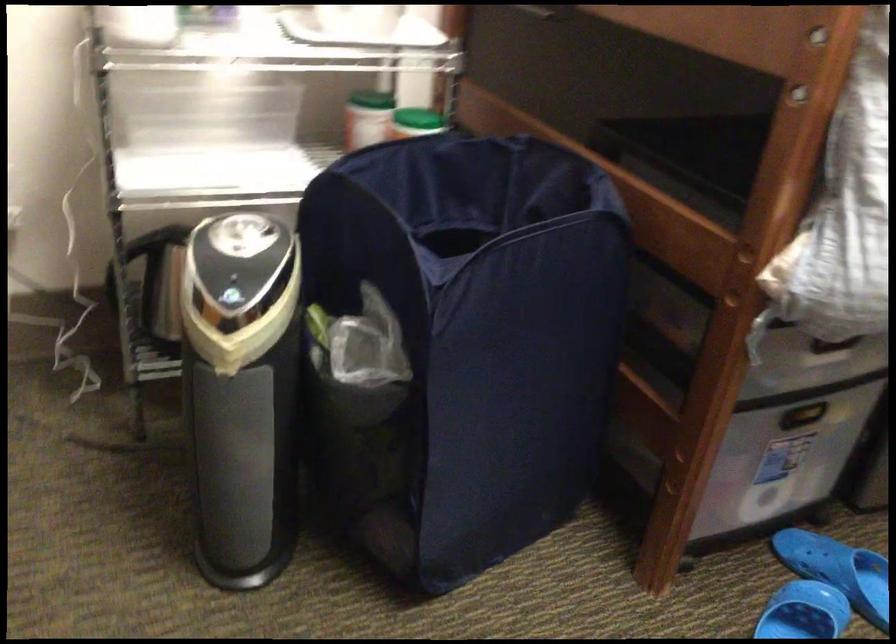
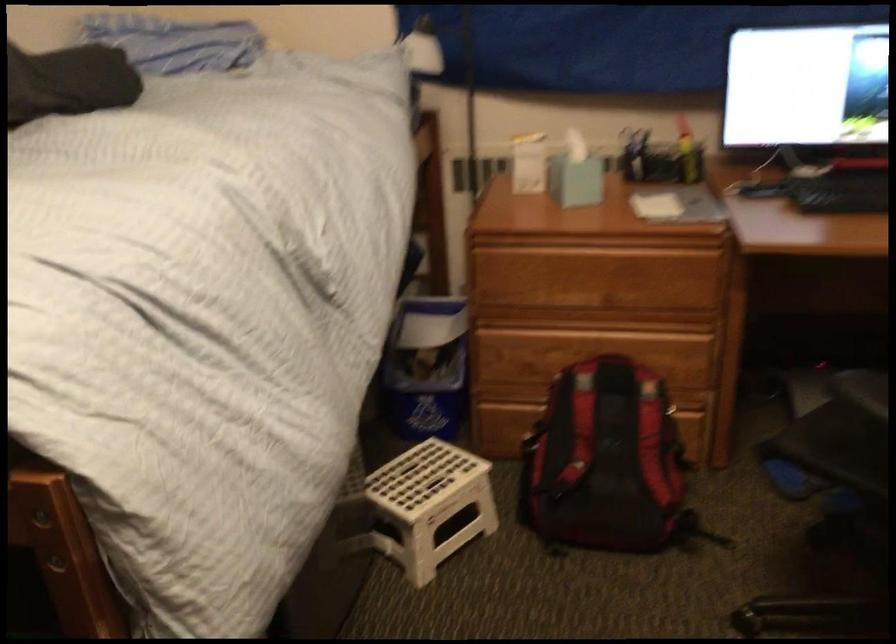
Question: The images are taken continuously from a first-person perspective. In which direction is your viewpoint rotating?

Choices:
 (A) Left
 (B) Right
 (C) Up
 (D) Down

Answer: (B)